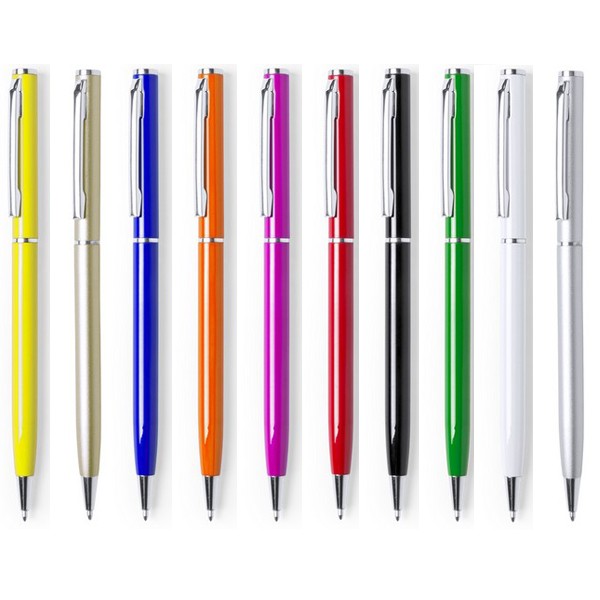
I want to click on pens, so click(x=24, y=304), click(x=85, y=303), click(x=147, y=303), click(x=210, y=303), click(x=277, y=303), click(x=342, y=301), click(x=397, y=304), click(x=456, y=301), click(x=514, y=300), click(x=571, y=300).